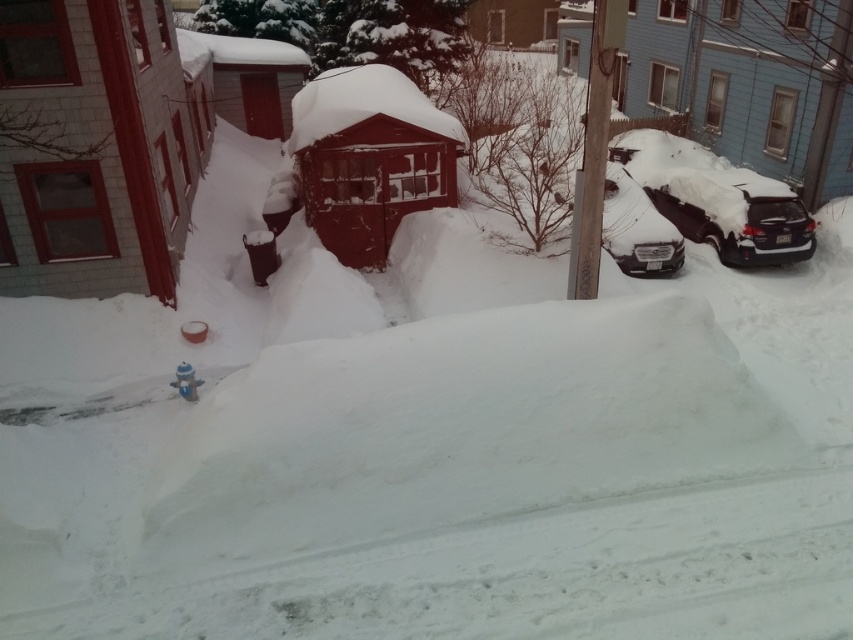
Question: Among these objects, which one is nearest to the camera?

Choices:
 (A) sleek silver sedan at center-right
 (B) brown wooden pole at upper right
 (C) blue metallic hydrant at lower center
 (D) sleek black car at right

Answer: (B)

Question: Which of the following is the closest to the observer?

Choices:
 (A) [657, 211]
 (B) [573, 262]
 (C) [751, 204]
 (D) [177, 369]

Answer: (D)

Question: Is brown wooden pole at upper right below sleek silver sedan at center-right?

Choices:
 (A) yes
 (B) no

Answer: (B)

Question: Is sleek black car at right smaller than brown wooden pole at upper right?

Choices:
 (A) yes
 (B) no

Answer: (A)

Question: Is brown wooden pole at upper right positioned at the back of blue metallic hydrant at lower center?

Choices:
 (A) yes
 (B) no

Answer: (B)

Question: Which object is farther from the camera taking this photo?

Choices:
 (A) blue metallic hydrant at lower center
 (B) sleek silver sedan at center-right
 (C) brown wooden pole at upper right
 (D) sleek black car at right

Answer: (D)